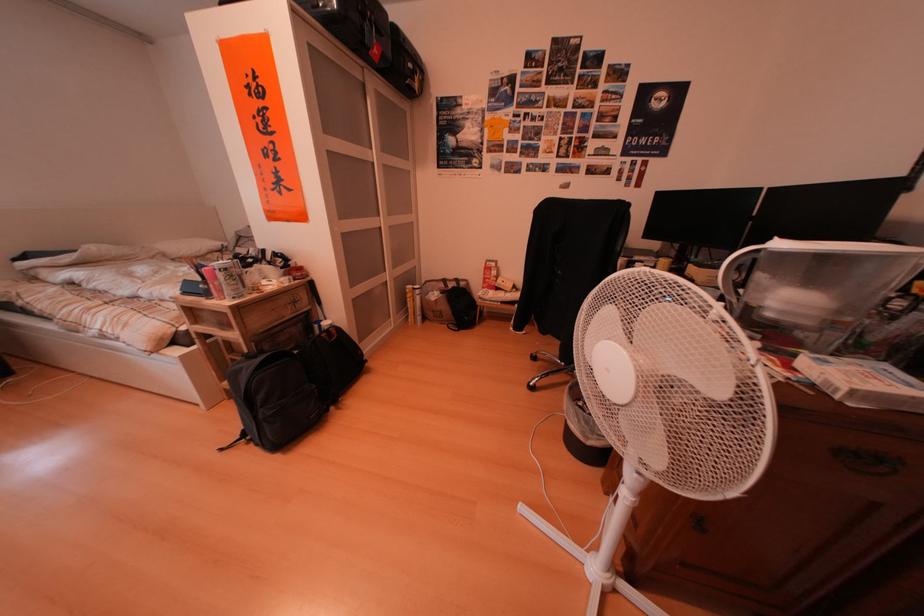
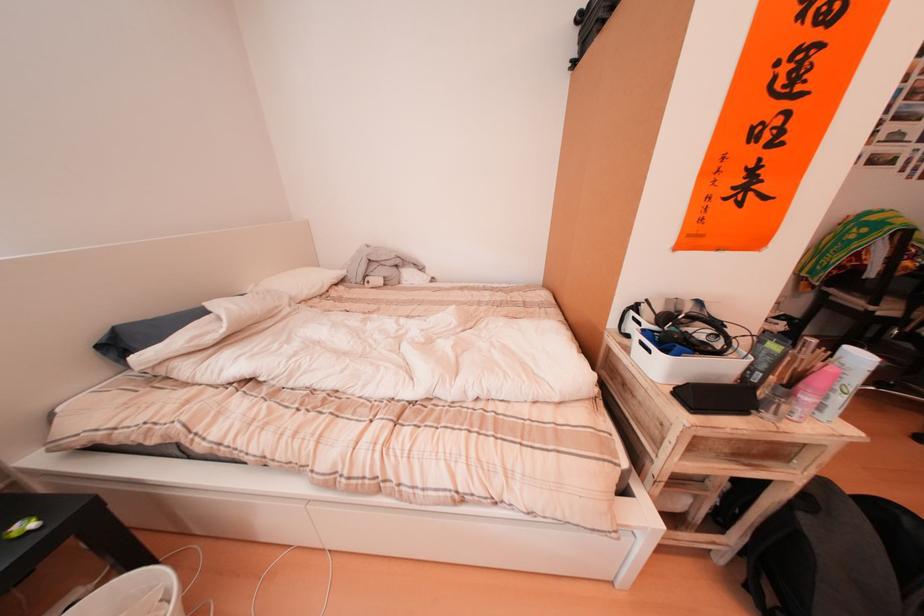
Locate, in the second image, the point that corresponds to (x=28, y=261) in the first image.

(105, 339)